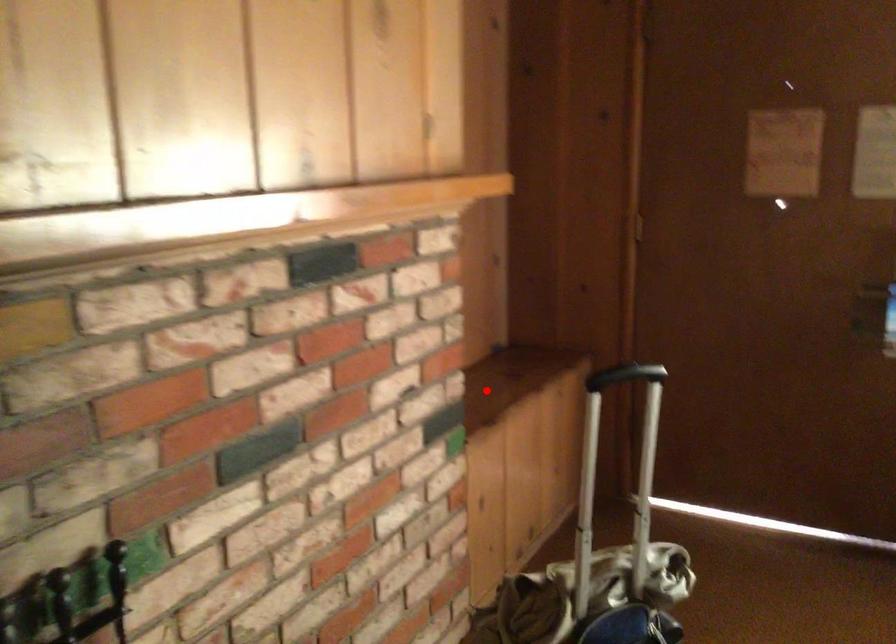
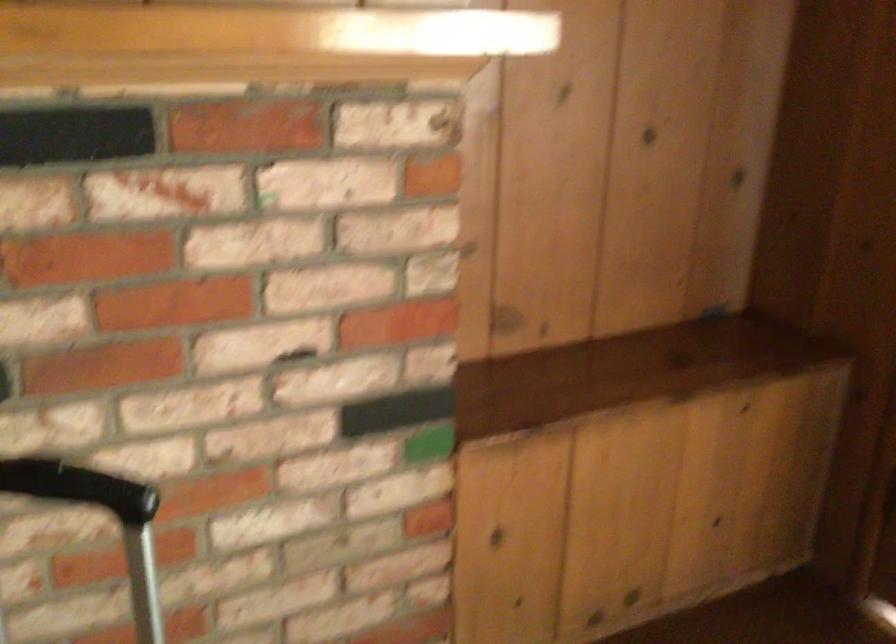
Question: I am providing you with two images of the same scene from different viewpoints. Image1 has a red point marked. In image2, the corresponding 3D location appears at what relative position? Reply with the corresponding letter.

Choices:
 (A) Closer
 (B) Farther

Answer: (A)